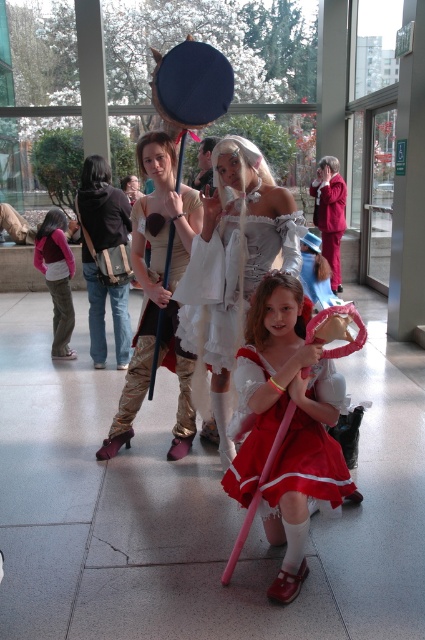
You are organizing a photo shoot in this convention hall and need to position the matte gold armor at center and the velvet red cape at center close to each other. Considering their sizes, which object should you place first to ensure they fit comfortably in the frame?

Since the matte gold armor at center occupies less space than the velvet red cape at center, you should place the velvet red cape at center first to accommodate its larger size, then position the smaller matte gold armor at center next to it.

You are a photographer positioned at the entrance of the hall. You need to capture a group photo of the white satin dress at center and the velvet red cape at center. Given that your camera has a maximum focus range of 5 meters, will you be able to capture both subjects clearly in the same frame?

The distance between the white satin dress at center and the velvet red cape at center is 5.33 meters, which exceeds the camera maximum focus range of 5 meters. Therefore, you cannot capture both subjects clearly in the same frame.

You are at a costume party and see the white satin dress at center and the matte pink sweater at left. Which one is more to the left?

The matte pink sweater at left is more to the left than the white satin dress at center.